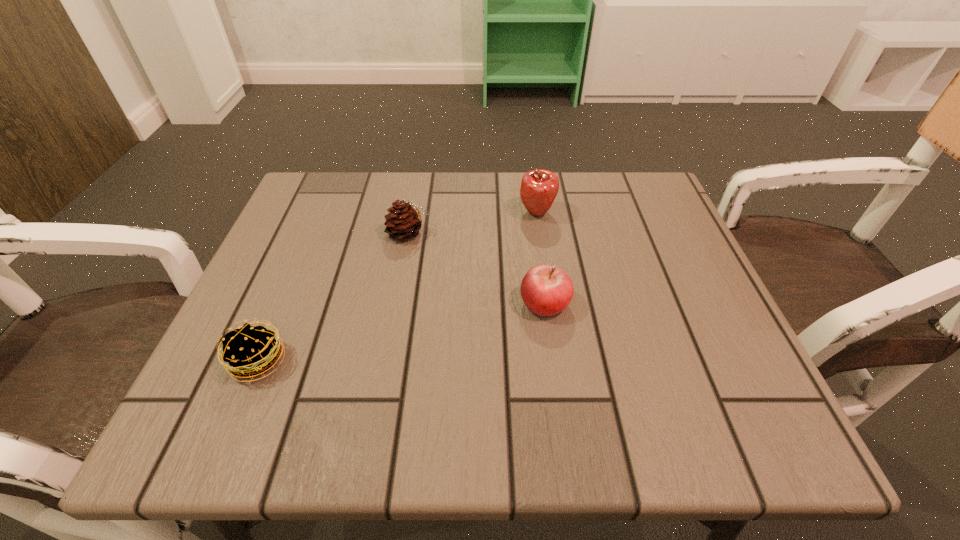
You are a GUI agent. You are given a task and a screenshot of the screen. Output one action in this format:
    pyautogui.click(x=<x>, y=<y>)
    Task: Click on the vacant point at the far right corner
    
    Given the screenshot: What is the action you would take?
    pyautogui.click(x=610, y=177)

Image resolution: width=960 pixels, height=540 pixels. What are the coordinates of `vacant space at the near right corner of the desktop` in the screenshot? It's located at (742, 422).

Locate an element on the screen. This screenshot has width=960, height=540. vacant area that lies between the shortest object and the tallest object is located at coordinates (397, 287).

At what (x,y) coordinates should I click in order to perform the action: click on vacant area that lies between the third object from right to left and the shorter apple. Please return your answer as a coordinate pair (x, y). This screenshot has width=960, height=540. Looking at the image, I should click on (477, 268).

You are a GUI agent. You are given a task and a screenshot of the screen. Output one action in this format:
    pyautogui.click(x=<x>, y=<y>)
    Task: Click on the free space between the third farthest object and the pinecone
    
    Given the screenshot: What is the action you would take?
    pyautogui.click(x=477, y=268)

Identify the location of vacant region between the pinecone and the third farthest object. tap(477, 268).

I want to click on free space that is in between the shortest object and the shorter apple, so click(401, 332).

The image size is (960, 540). What are the coordinates of `free space between the nearest object and the tallest object` in the screenshot? It's located at (397, 287).

At what (x,y) coordinates should I click in order to perform the action: click on free spot between the nearer apple and the tallest object. Please return your answer as a coordinate pair (x, y). The height and width of the screenshot is (540, 960). Looking at the image, I should click on (540, 258).

At what (x,y) coordinates should I click in order to perform the action: click on vacant point located between the taller apple and the shorter apple. Please return your answer as a coordinate pair (x, y). The image size is (960, 540). Looking at the image, I should click on (540, 258).